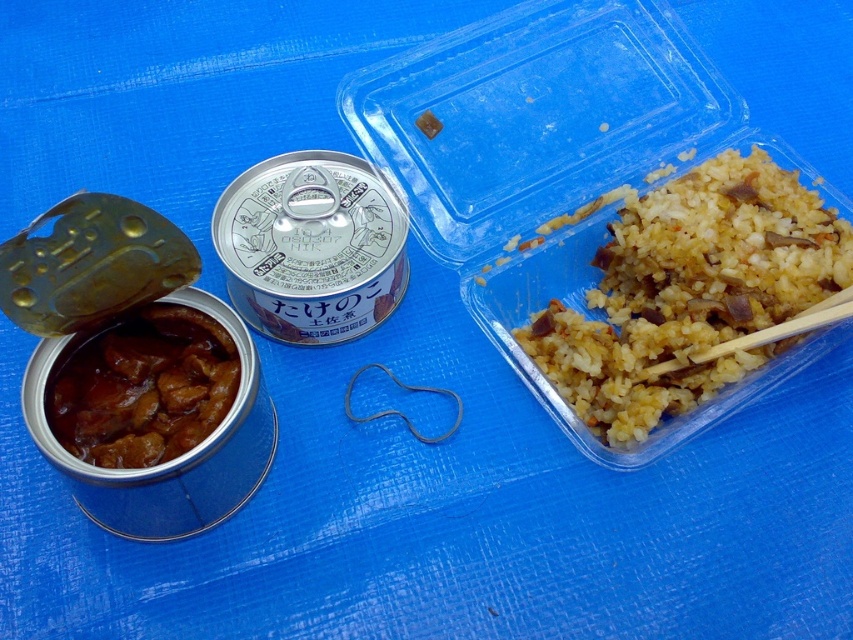
You are planning to serve a meal and have a plate that is 15 cm wide. You need to place both the brown rice at right and the brown glossy meat at center on the plate. Can both items fit side by side on the plate without overlapping?

The brown rice at right is wider than the brown glossy meat at center. However, since the combined width of both items is not specified, it is unclear if they can fit side by side on a 15 cm wide plate.

You are a food photographer and need to adjust the composition so that the brown glossy meat at center is positioned to the right of the brown rice at right. Is this possible based on their current arrangement?

The brown rice at right is currently to the right of the brown glossy meat at center, so moving the brown glossy meat at center to the right of the brown rice at right would require shifting it further right, which might not be possible without overlapping or moving other elements.